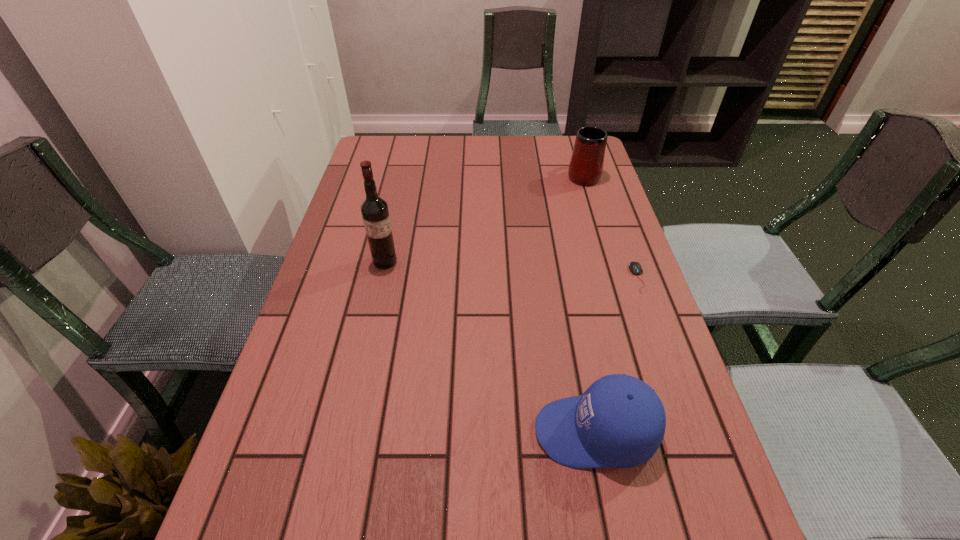
Image resolution: width=960 pixels, height=540 pixels. Find the location of `vacant area that lies between the cap and the shortest object`. vacant area that lies between the cap and the shortest object is located at coordinates (616, 355).

Where is `vacant area that lies between the mouse and the second shortest object`? vacant area that lies between the mouse and the second shortest object is located at coordinates (616, 355).

Where is `blank region between the mouse and the tallest object`? The image size is (960, 540). blank region between the mouse and the tallest object is located at coordinates click(512, 269).

At what (x,y) coordinates should I click in order to perform the action: click on blank region between the leftmost object and the shortest object. Please return your answer as a coordinate pair (x, y). Looking at the image, I should click on (x=512, y=269).

At what (x,y) coordinates should I click in order to perform the action: click on object that stands as the third closest to the second shortest object. Please return your answer as a coordinate pair (x, y). Looking at the image, I should click on (586, 165).

Image resolution: width=960 pixels, height=540 pixels. Identify the location of object that ranks as the third closest to the cap. (586, 165).

What are the coordinates of `free location that satisfies the following two spatial constraints: 1. on the front and back of the wine bottle; 2. on the right side of the mouse` in the screenshot? It's located at (381, 278).

Locate an element on the screen. vacant space that satisfies the following two spatial constraints: 1. on the front side of the mouse; 2. on the front-facing side of the cap is located at coordinates (693, 432).

You are a GUI agent. You are given a task and a screenshot of the screen. Output one action in this format:
    pyautogui.click(x=<x>, y=<y>)
    Task: Click on the vacant point that satisfies the following two spatial constraints: 1. on the front and back of the leftmost object; 2. on the left side of the mouse
    The image size is (960, 540).
    Given the screenshot: What is the action you would take?
    pyautogui.click(x=381, y=278)